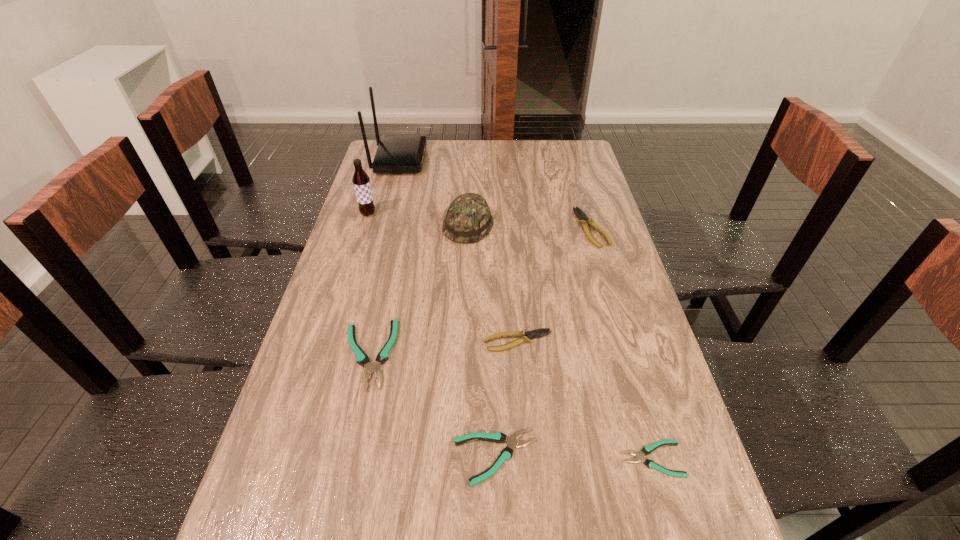
I want to click on vacant space that satisfies the following two spatial constraints: 1. on the front side of the second tallest object; 2. on the left side of the leftmost teal pliers, so click(x=324, y=354).